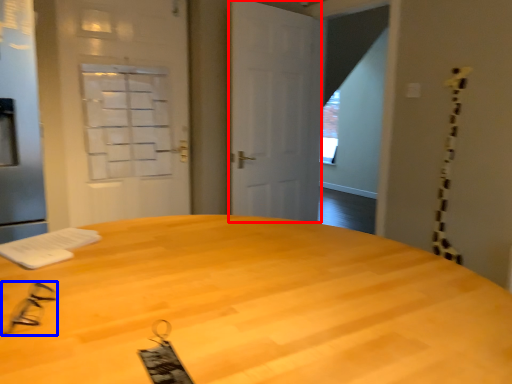
Question: Among these objects, which one is farthest to the camera, door (highlighted by a red box) or glasses (highlighted by a blue box)?

Choices:
 (A) door
 (B) glasses

Answer: (A)